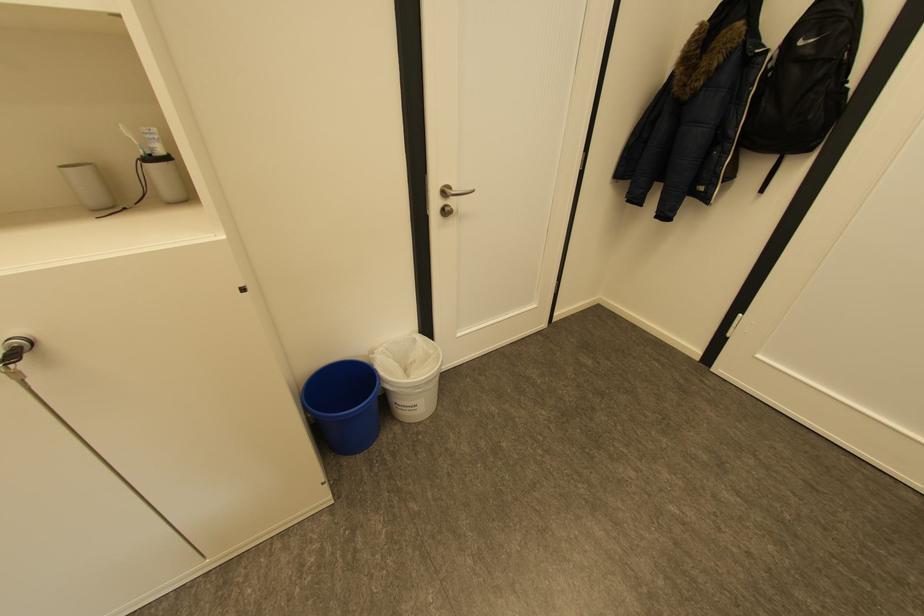
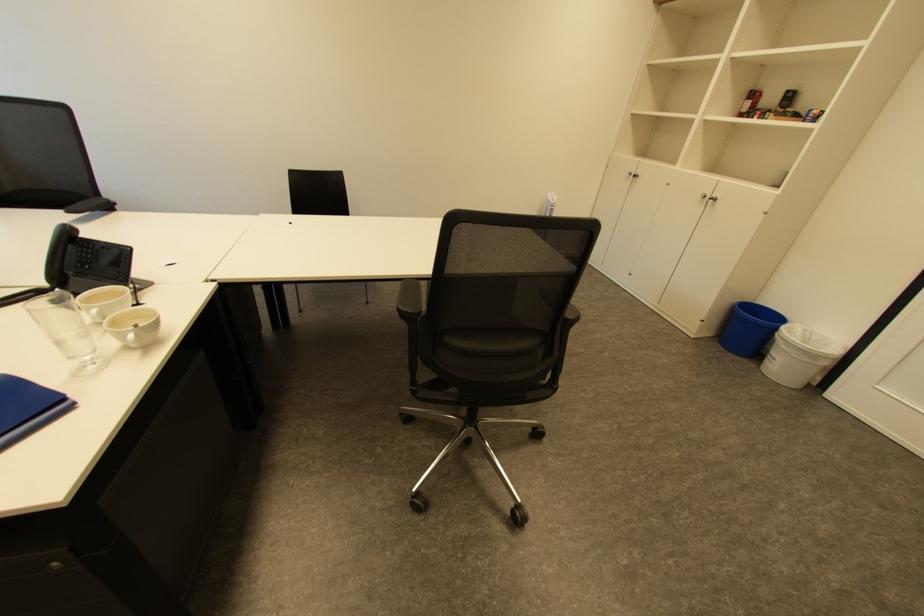
Locate, in the second image, the point that corresponds to point (403, 428) in the first image.

(760, 365)